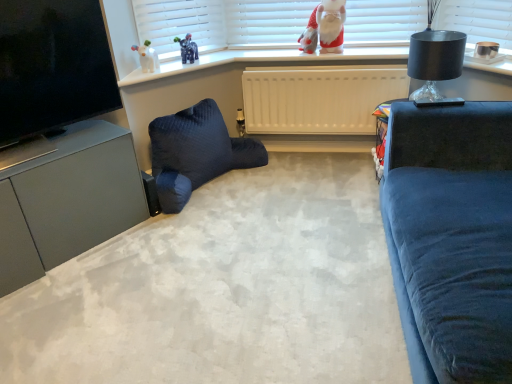
Question: Is white glossy window sill at upper center taller or shorter than white glossy elephant at upper left?

Choices:
 (A) tall
 (B) short

Answer: (B)

Question: Visually, is white glossy window sill at upper center positioned to the left or to the right of white glossy elephant at upper left?

Choices:
 (A) left
 (B) right

Answer: (B)

Question: Considering the real-world distances, which object is closest to the matte black tv at left?

Choices:
 (A) black glass lamp at upper right
 (B) white glossy elephant at upper left
 (C) satin grey cabinet at lower left
 (D) white matte radiator at center
 (E) dark blue quilted bean bag chair at lower left

Answer: (C)

Question: Which object is the farthest from the white matte radiator at center?

Choices:
 (A) white glossy elephant at upper left
 (B) black glass lamp at upper right
 (C) dark blue quilted bean bag chair at lower left
 (D) satin grey cabinet at lower left
 (E) white glossy window sill at upper center

Answer: (D)